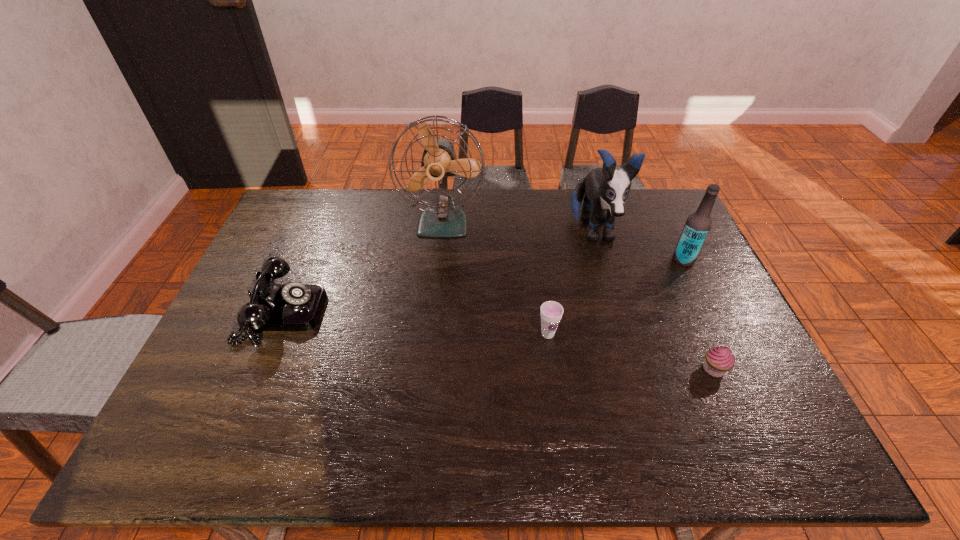
In the image, there is a desktop. At what (x,y) coordinates should I click in order to perform the action: click on free region at the far edge. Please return your answer as a coordinate pair (x, y). The width and height of the screenshot is (960, 540). Looking at the image, I should click on (395, 198).

This screenshot has width=960, height=540. I want to click on free space at the left edge, so click(x=251, y=368).

This screenshot has width=960, height=540. Identify the location of vacant point at the right edge. (724, 321).

The width and height of the screenshot is (960, 540). What are the coordinates of `free region at the near left corner` in the screenshot? It's located at (186, 445).

This screenshot has width=960, height=540. I want to click on vacant space in between the beer bottle and the puppy, so click(637, 246).

Identify the location of vacant space in between the cupcake and the third shortest object. pyautogui.click(x=498, y=341).

Image resolution: width=960 pixels, height=540 pixels. I want to click on free spot between the third object from left to right and the third tallest object, so click(615, 297).

Locate an element on the screen. The image size is (960, 540). free spot between the cup and the puppy is located at coordinates (570, 282).

Where is `free space between the fourth object from right to left and the fifth object from right to left`? The width and height of the screenshot is (960, 540). free space between the fourth object from right to left and the fifth object from right to left is located at coordinates (495, 278).

Locate an element on the screen. vacant space in between the fourth object from right to left and the fan is located at coordinates (495, 278).